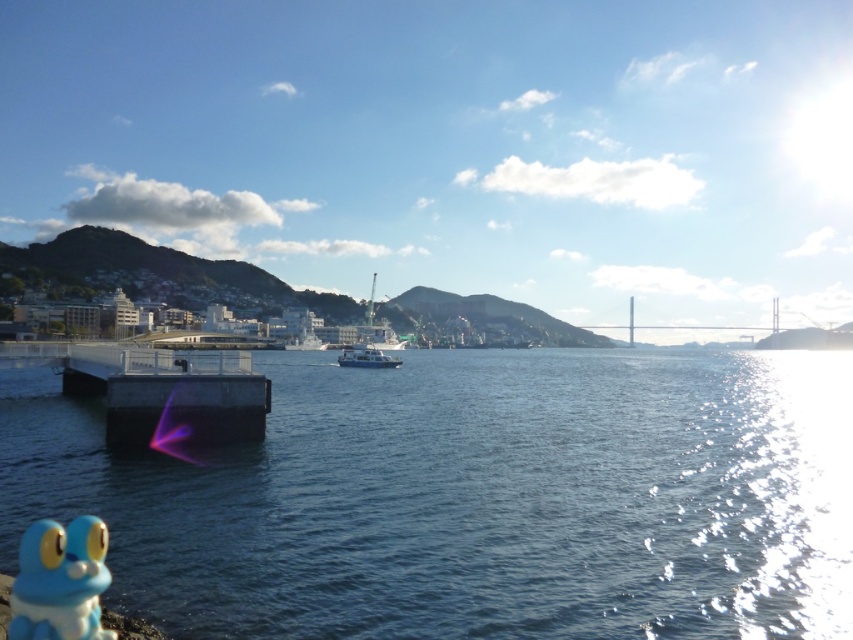
You are a photographer trying to capture both the blue rubber frog at lower left and the white matte boat at center in a single shot. Which object will appear smaller in the photo?

The blue rubber frog at lower left will appear smaller in the photo because it has a lesser height compared to the white matte boat at center.